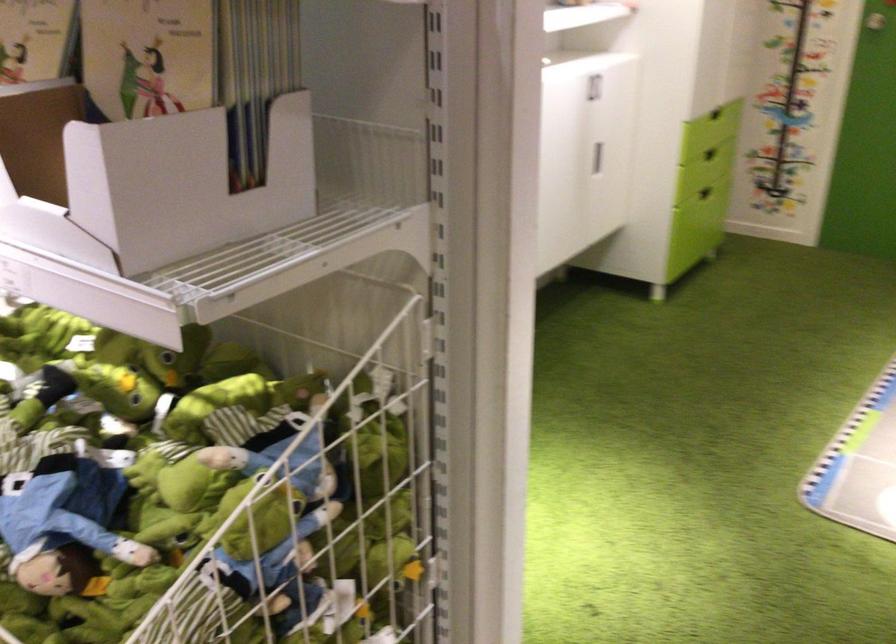
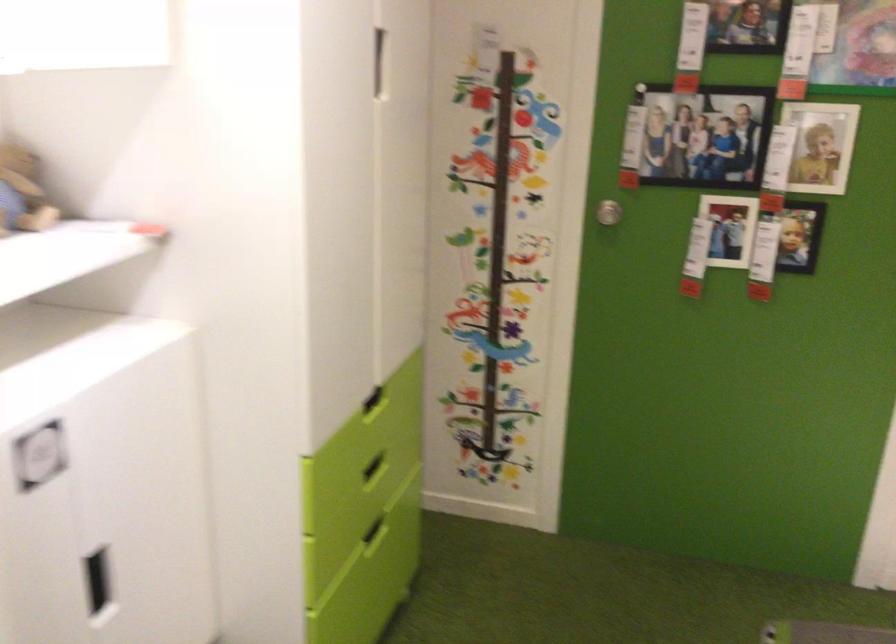
In the second image, find the point that corresponds to [719,145] in the first image.

(374, 468)